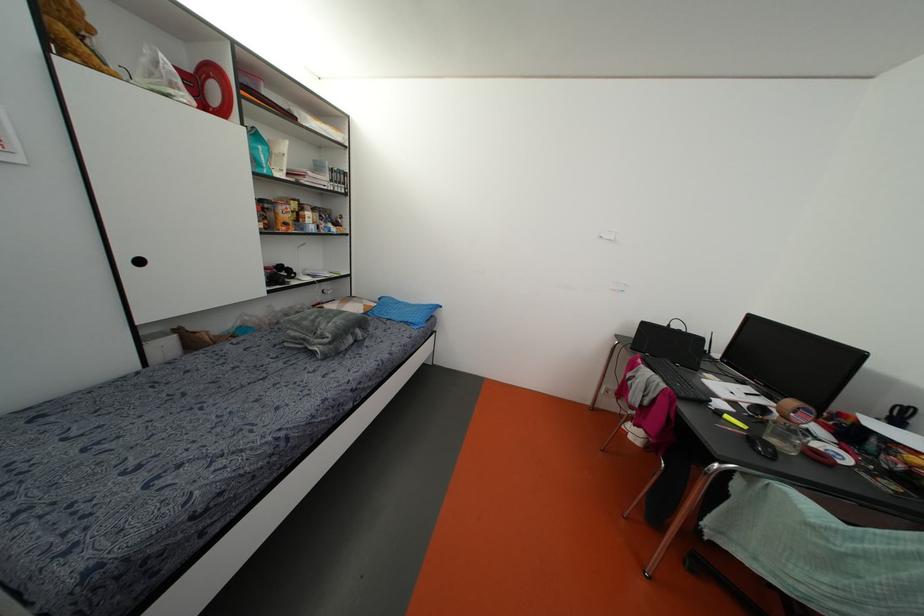
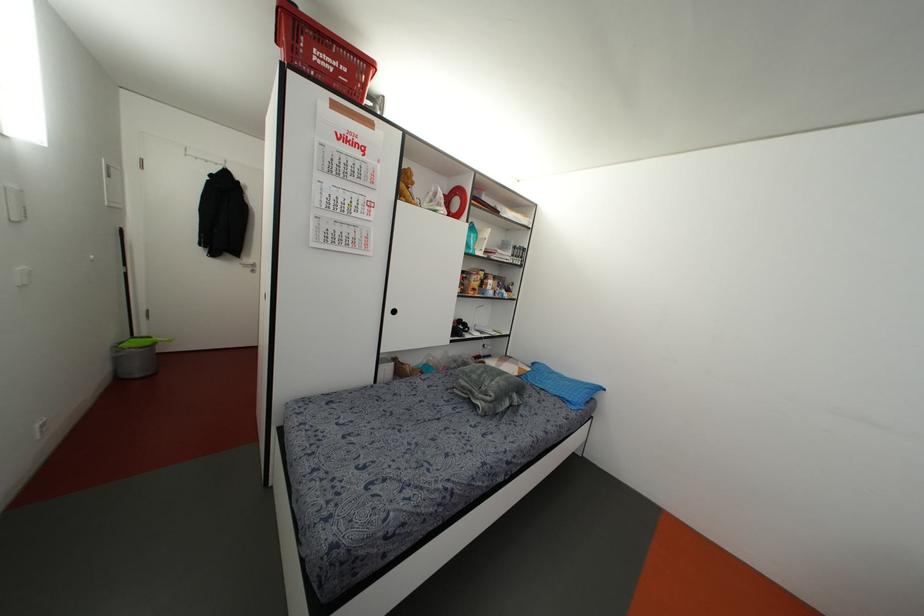
Question: Based on the continuous images, in which direction is the camera rotating? Reply with the corresponding letter.

Choices:
 (A) Left
 (B) Right
 (C) Up
 (D) Down

Answer: (A)